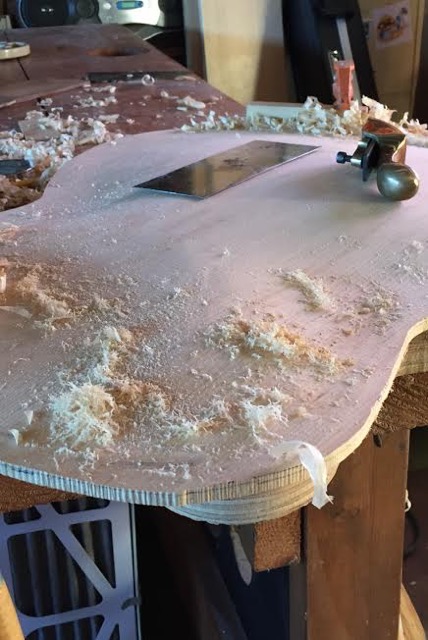
You are a GUI agent. You are given a task and a screenshot of the screen. Output one action in this format:
    pyautogui.click(x=<x>, y=<y>)
    Task: Click on the wood table
    The image size is (428, 640).
    Given the screenshot: What is the action you would take?
    pyautogui.click(x=135, y=116)